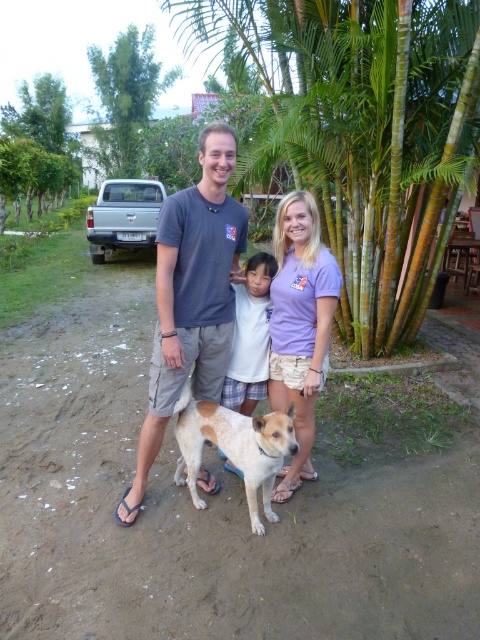
You are standing at the origin of the coordinate system. You see a point at coordinate (192, 298). What object is located at that point?

The point at coordinate (192, 298) corresponds to the dark gray t shirt at center.